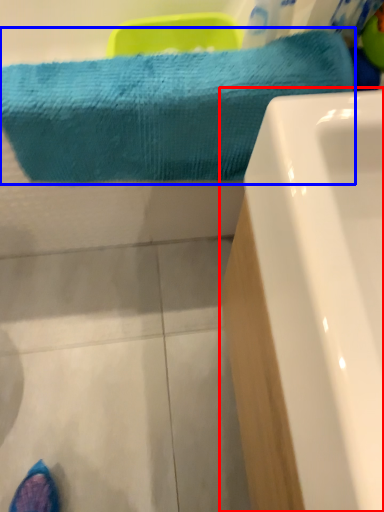
Question: Among these objects, which one is nearest to the camera, bathtub (highlighted by a red box) or towel (highlighted by a blue box)?

Choices:
 (A) bathtub
 (B) towel

Answer: (A)